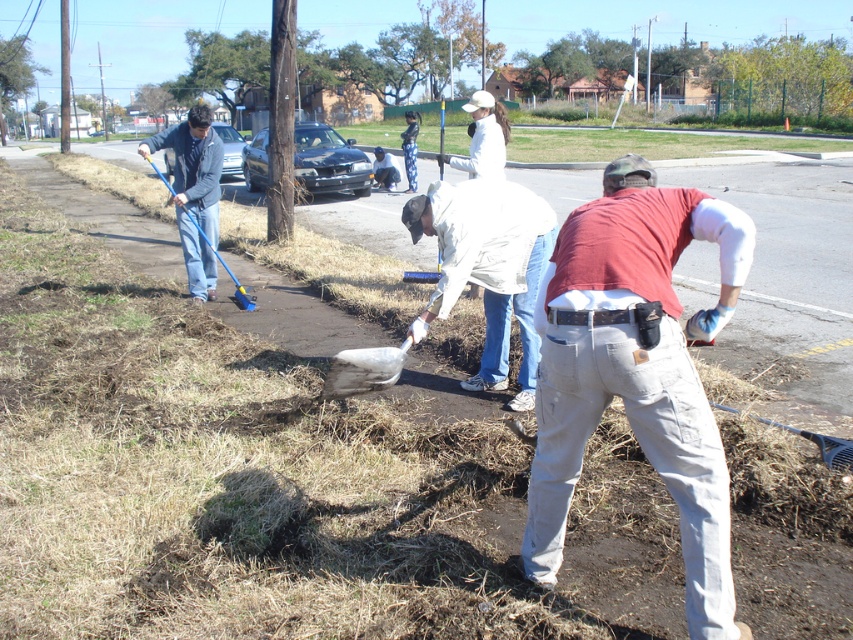
This screenshot has height=640, width=853. What do you see at coordinates (488, 268) in the screenshot?
I see `white matte jacket at center` at bounding box center [488, 268].

Does white matte jacket at center come behind white plastic shovel at center?

Yes, white matte jacket at center is behind white plastic shovel at center.

Is point (418, 228) positioned behind point (393, 348)?

Yes, point (418, 228) is behind point (393, 348).

The image size is (853, 640). Identify the location of white matte jacket at center. (488, 268).

Measure the distance between white matte jacket at center and camera.

They are 16.11 feet apart.

Is point (527, 401) more distant than point (233, 273)?

That is False.

You are a GUI agent. You are given a task and a screenshot of the screen. Output one action in this format:
    pyautogui.click(x=<x>, y=<y>)
    Task: Click on the white matte jacket at center
    The height and width of the screenshot is (640, 853).
    Given the screenshot: What is the action you would take?
    pyautogui.click(x=488, y=268)

Does denim jeans at lower right appear over white plastic shovel at center?

Correct, denim jeans at lower right is located above white plastic shovel at center.

Does denim jeans at lower right have a smaller size compared to white plastic shovel at center?

No.

Is point (635, 259) in front of point (368, 374)?

That is True.

In order to click on denim jeans at lower right in this screenshot , I will do `click(635, 371)`.